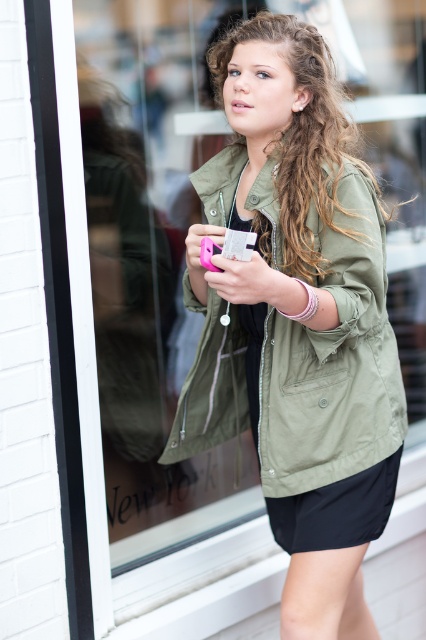
From the picture: Based on the scene description, which clothing item is positioned higher on the person? The olive green fabric jacket at center or the black smooth shorts at lower center?

The olive green fabric jacket at center is much taller as black smooth shorts at lower center, so the olive green fabric jacket at center is positioned higher on the person.

Based on the scene description, which object occupies more space in the image between the olive green fabric jacket at center and the black smooth shorts at lower center?

The olive green fabric jacket at center occupies more space in the image as it is larger in size than the black smooth shorts at lower center.